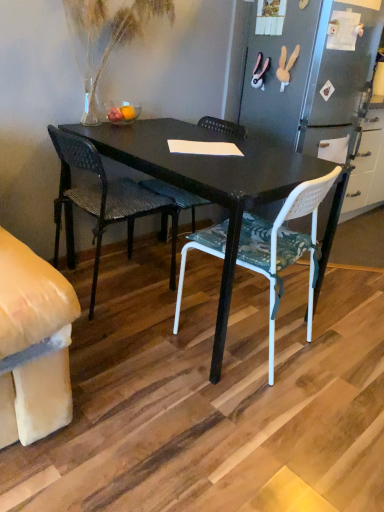
Question: Is the position of white plastic chair at center, placed as the 1th chair when sorted from right to left, less distant than that of translucent glass vase at upper left?

Choices:
 (A) no
 (B) yes

Answer: (B)

Question: Considering the relative positions of white plastic chair at center, the 2th chair in the left-to-right sequence, and translucent glass vase at upper left in the image provided, is white plastic chair at center, the 2th chair in the left-to-right sequence, behind translucent glass vase at upper left?

Choices:
 (A) yes
 (B) no

Answer: (B)

Question: Can you confirm if white plastic chair at center, placed as the 1th chair when sorted from right to left, is positioned to the right of translucent glass vase at upper left?

Choices:
 (A) yes
 (B) no

Answer: (A)

Question: From a real-world perspective, is white plastic chair at center, the 2th chair in the left-to-right sequence, under translucent glass vase at upper left?

Choices:
 (A) yes
 (B) no

Answer: (A)

Question: From the image's perspective, would you say white plastic chair at center, placed as the 1th chair when sorted from right to left, is shown under translucent glass vase at upper left?

Choices:
 (A) yes
 (B) no

Answer: (A)

Question: Is woven dark brown chair at center, which ranks as the 1th chair in left-to-right order, inside or outside of translucent glass vase at upper left?

Choices:
 (A) outside
 (B) inside

Answer: (A)

Question: From their relative heights in the image, would you say woven dark brown chair at center, which ranks as the 1th chair in left-to-right order, is taller or shorter than translucent glass vase at upper left?

Choices:
 (A) short
 (B) tall

Answer: (B)

Question: Looking at their shapes, would you say woven dark brown chair at center, which ranks as the 1th chair in left-to-right order, is wider or thinner than translucent glass vase at upper left?

Choices:
 (A) thin
 (B) wide

Answer: (B)

Question: Based on their positions, is woven dark brown chair at center, which ranks as the 1th chair in left-to-right order, located to the left or right of translucent glass vase at upper left?

Choices:
 (A) left
 (B) right

Answer: (A)

Question: In terms of width, does white plastic chair at center, the 2th chair in the left-to-right sequence, look wider or thinner when compared to woven dark brown chair at center, which ranks as the 1th chair in left-to-right order?

Choices:
 (A) thin
 (B) wide

Answer: (B)

Question: Looking at the image, does white plastic chair at center, the 2th chair in the left-to-right sequence, seem bigger or smaller compared to woven dark brown chair at center, which is the second chair in right-to-left order?

Choices:
 (A) small
 (B) big

Answer: (B)

Question: Is white plastic chair at center, the 2th chair in the left-to-right sequence, in front of or behind woven dark brown chair at center, which is the second chair in right-to-left order, in the image?

Choices:
 (A) front
 (B) behind

Answer: (A)

Question: Is point (306, 325) closer or farther from the camera than point (79, 164)?

Choices:
 (A) closer
 (B) farther

Answer: (B)

Question: Is point (56, 128) closer or farther from the camera than point (271, 351)?

Choices:
 (A) farther
 (B) closer

Answer: (A)

Question: Is woven dark brown chair at center, which is the second chair in right-to-left order, taller or shorter than white plastic chair at center, the 2th chair in the left-to-right sequence?

Choices:
 (A) tall
 (B) short

Answer: (A)